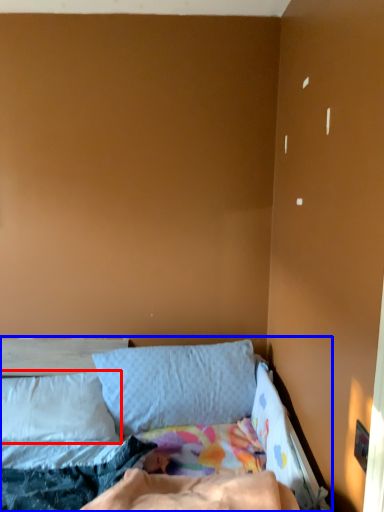
Question: Which object is closer to the camera taking this photo, pillow (highlighted by a red box) or bed (highlighted by a blue box)?

Choices:
 (A) pillow
 (B) bed

Answer: (B)